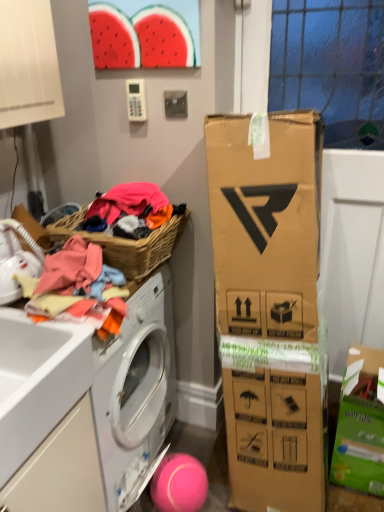
Question: Is woven brown picnic basket at left to the right of pink rubber ball at lower center from the viewer's perspective?

Choices:
 (A) no
 (B) yes

Answer: (A)

Question: Does woven brown picnic basket at left have a smaller size compared to pink rubber ball at lower center?

Choices:
 (A) no
 (B) yes

Answer: (A)

Question: Can you confirm if woven brown picnic basket at left is thinner than pink rubber ball at lower center?

Choices:
 (A) yes
 (B) no

Answer: (B)

Question: Is woven brown picnic basket at left looking in the opposite direction of pink rubber ball at lower center?

Choices:
 (A) no
 (B) yes

Answer: (A)

Question: From the image's perspective, is woven brown picnic basket at left on pink rubber ball at lower center?

Choices:
 (A) no
 (B) yes

Answer: (B)

Question: Considering their positions, is white matte drawer at lower left located in front of or behind woven brown picnic basket at left?

Choices:
 (A) behind
 (B) front

Answer: (B)

Question: In terms of width, does white matte drawer at lower left look wider or thinner when compared to woven brown picnic basket at left?

Choices:
 (A) wide
 (B) thin

Answer: (A)

Question: Does point (46, 460) appear closer or farther from the camera than point (76, 233)?

Choices:
 (A) closer
 (B) farther

Answer: (A)

Question: Which is correct: white matte drawer at lower left is inside woven brown picnic basket at left, or outside of it?

Choices:
 (A) outside
 (B) inside

Answer: (A)

Question: From the image's perspective, relative to woven brown picnic basket at left, is pink rubber ball at lower center above or below?

Choices:
 (A) below
 (B) above

Answer: (A)

Question: Choose the correct answer: Is pink rubber ball at lower center inside woven brown picnic basket at left or outside it?

Choices:
 (A) inside
 (B) outside

Answer: (B)

Question: From a real-world perspective, relative to woven brown picnic basket at left, is pink rubber ball at lower center vertically above or below?

Choices:
 (A) above
 (B) below

Answer: (B)

Question: Is point (165, 461) positioned closer to the camera than point (139, 245)?

Choices:
 (A) closer
 (B) farther

Answer: (B)

Question: From a real-world perspective, is woven brown picnic basket at left positioned above or below pink rubber ball at lower center?

Choices:
 (A) below
 (B) above

Answer: (B)

Question: Is woven brown picnic basket at left spatially inside pink rubber ball at lower center, or outside of it?

Choices:
 (A) inside
 (B) outside

Answer: (B)